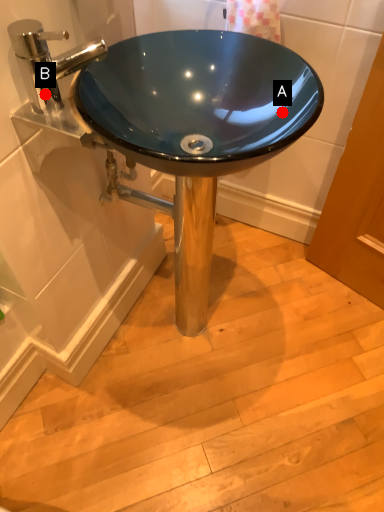
Question: Two points are circled on the image, labeled by A and B beside each circle. Which point is closer to the camera?

Choices:
 (A) A is closer
 (B) B is closer

Answer: (B)